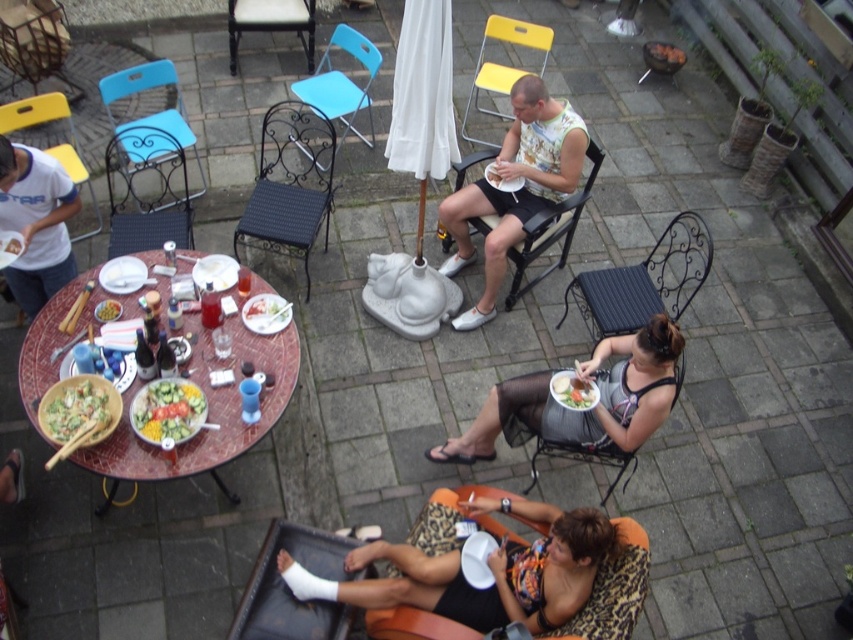
Who is positioned more to the left, black metal chair at upper left or green leafy salad at lower center?

From the viewer's perspective, black metal chair at upper left appears more on the left side.

Does black metal chair at upper left have a lesser height compared to green leafy salad at lower center?

In fact, black metal chair at upper left may be taller than green leafy salad at lower center.

This screenshot has height=640, width=853. In order to click on black metal chair at upper left in this screenshot , I will do `click(152, 198)`.

Where is `black metal chair at upper left`? Image resolution: width=853 pixels, height=640 pixels. black metal chair at upper left is located at coordinates (152, 198).

Can you confirm if white porcelain plate at center is positioned above green leafy salad at lower center?

Yes, white porcelain plate at center is above green leafy salad at lower center.

Who is positioned more to the left, white porcelain plate at center or green leafy salad at lower center?

Positioned to the left is white porcelain plate at center.

Image resolution: width=853 pixels, height=640 pixels. In order to click on white porcelain plate at center in this screenshot , I will do `click(265, 314)`.

Is matte gray dress at lower center positioned at the back of green leafy salad at lower center?

No, it is not.

Does point (532, 374) come behind point (595, 385)?

That is True.

Locate an element on the screen. matte gray dress at lower center is located at coordinates (581, 412).